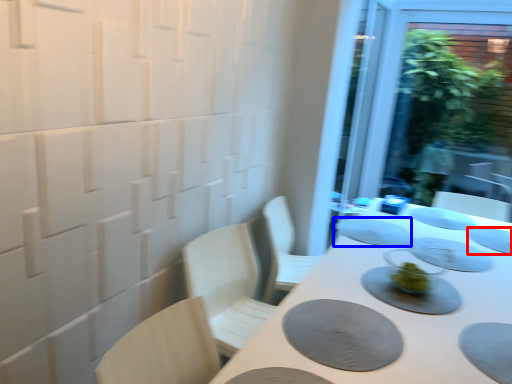
Question: Among these objects, which one is nearest to the camera, tableware (highlighted by a red box) or tableware (highlighted by a blue box)?

Choices:
 (A) tableware
 (B) tableware

Answer: (A)